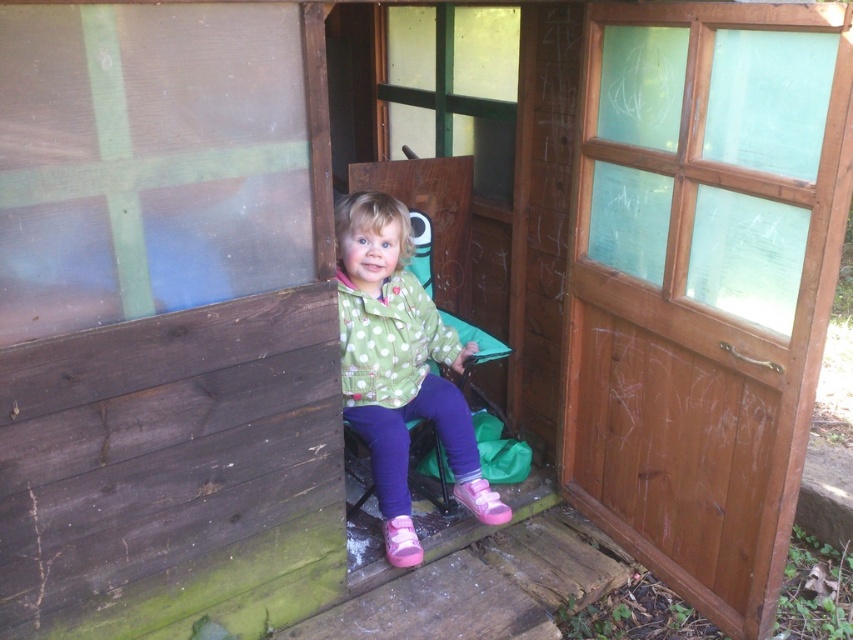
In the scene shown: You are a parent trying to enter the wooden structure where your child is sitting. The wooden screen door at center is closed. Can you step over the green polka dot jacket at center to reach the door handle on the right side?

The wooden screen door at center is taller than the green polka dot jacket at center, so yes, you can step over the green polka dot jacket at center to reach the door handle on the right side of the wooden screen door at center.

You are standing outside the wooden structure and want to enter. There are two points marked on the door. The first point is at coordinates point (732,317), and the second point is at point (352,268). Which point is closer to the entrance of the wooden structure?

Point (732,317) is in front of point (352,268), so the first point is closer to the entrance of the wooden structure.

Looking at this image, you are standing outside the wooden structure and want to locate the point at coordinates (704, 284). Where on the wooden structure would you find this point?

The point at coordinates (704, 284) is located on the wooden screen door at center.